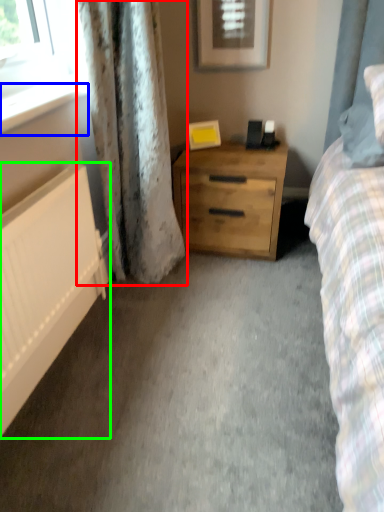
Question: Which is farther away from curtain (highlighted by a red box)? window sill (highlighted by a blue box) or radiator (highlighted by a green box)?

Choices:
 (A) window sill
 (B) radiator

Answer: (B)